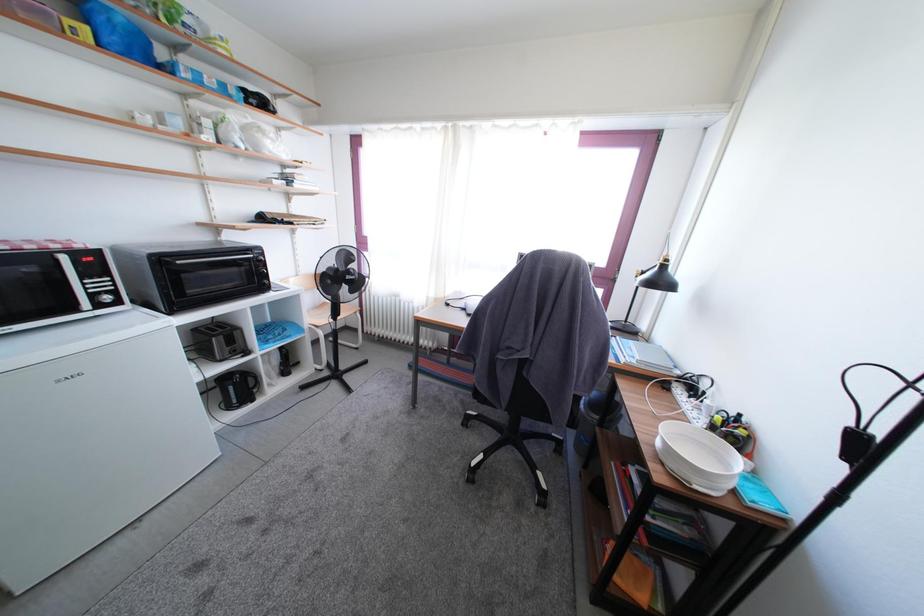
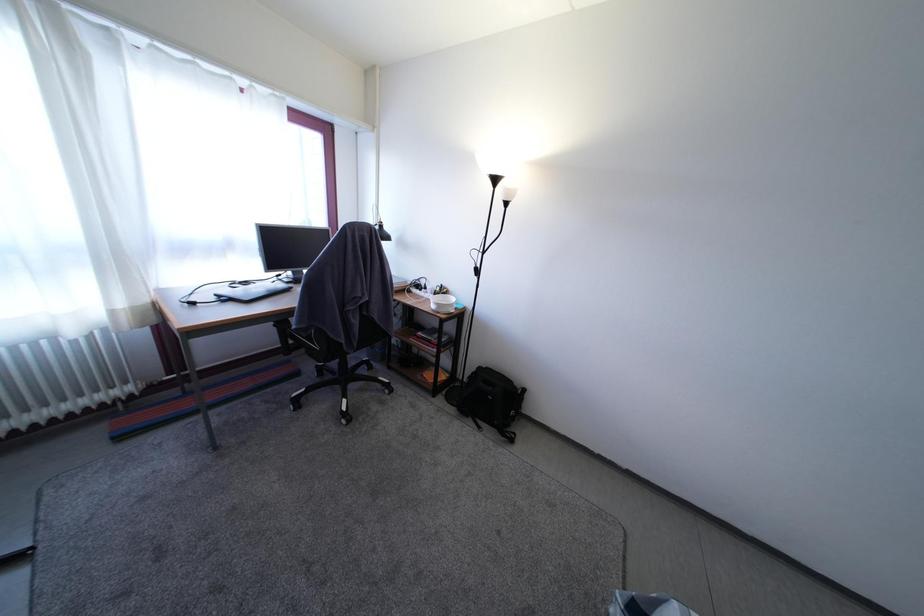
First-person continuous shooting, in which direction is the camera rotating?

The rotation direction of the camera is right-down.